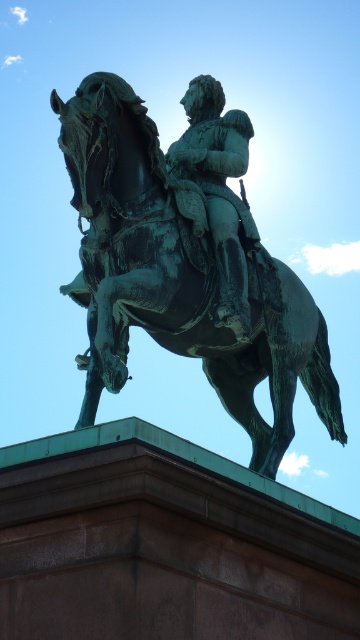
You are an art conservator assessing the bronze equestrian statue. You notice both the green patina statue at center and the green patina armor at center. Which object would require a larger conservation treatment area due to its size?

The green patina statue at center is bigger than the green patina armor at center, so it would require a larger conservation treatment area.

You are standing in front of the bronze equestrian statue. You notice two points marked on the statue. The first point is at coordinates point (78, 189) and the second point is at point (230, 173). If you were to walk towards the statue, which point would appear closer to you?

Point (78, 189) is closer to the viewer than point (230, 173), so it would appear closer when you walk towards the statue.

You are standing at the origin point of the coordinate system in the image. The statue is located at coordinates 0.434, 0.497. If you want to walk directly towards the green patina statue at center, which direction should you head?

Since the statue is at coordinates [178,276] and you are at the origin, you should move northeast to reach the green patina statue at center.